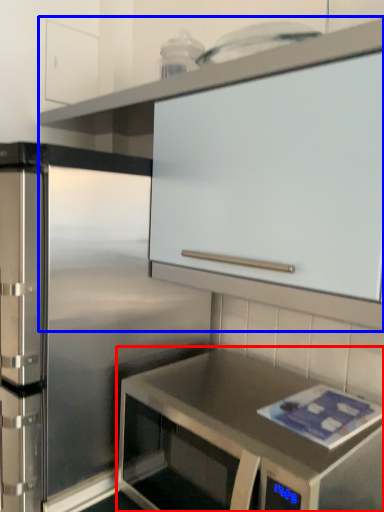
Question: Among these objects, which one is nearest to the camera, countertop (highlighted by a red box) or cabinetry (highlighted by a blue box)?

Choices:
 (A) countertop
 (B) cabinetry

Answer: (B)